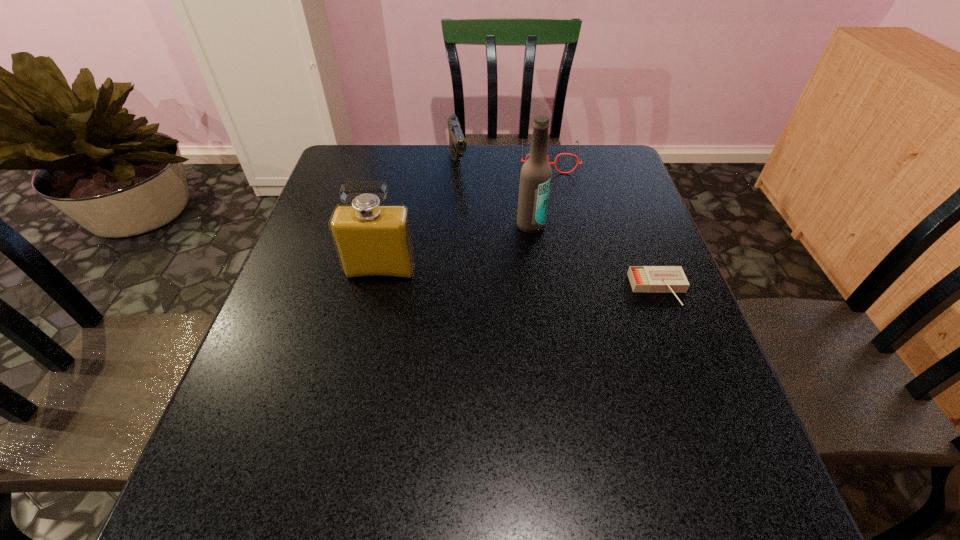
Locate an element on the screen. The image size is (960, 540). free spot on the desktop that is between the perfume and the matchbox and is positioned at the barrel of the pistol is located at coordinates (492, 278).

Where is `vacant spot on the desktop that is between the perfume and the rightmost object and is positioned on the label of the beer bottle`? This screenshot has width=960, height=540. vacant spot on the desktop that is between the perfume and the rightmost object and is positioned on the label of the beer bottle is located at coordinates (553, 282).

What are the coordinates of `vacant space on the desktop that is between the fourth shortest object and the rightmost object and is positioned on the front-facing side of the second shortest object` in the screenshot? It's located at (557, 282).